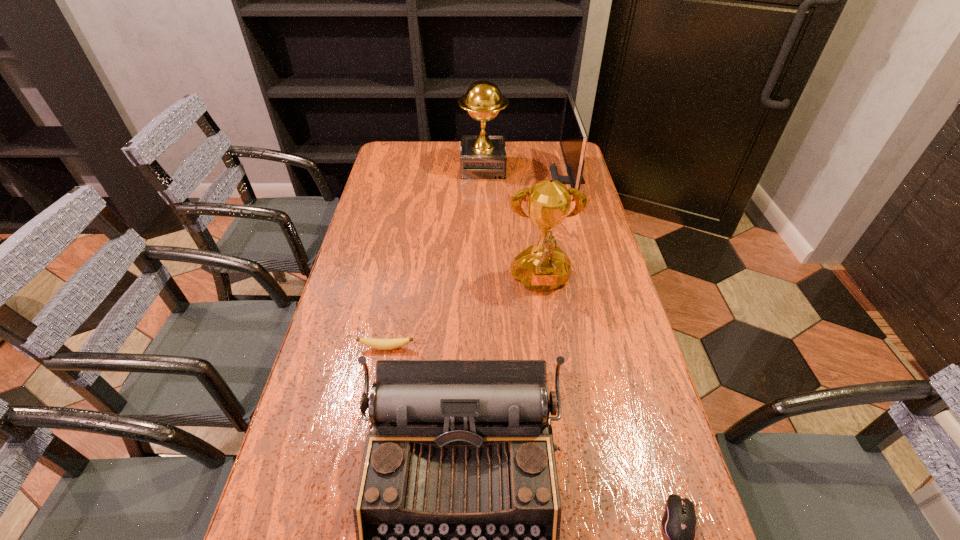
Identify the location of free region located on the screen side of the fourth shortest object. This screenshot has height=540, width=960. (537, 181).

At what (x,y) coordinates should I click in order to perform the action: click on blank space located 0.130m on the back of the fourth farthest object. Please return your answer as a coordinate pair (x, y). The height and width of the screenshot is (540, 960). Looking at the image, I should click on (395, 306).

This screenshot has width=960, height=540. Identify the location of award that is at the far edge. (482, 156).

Where is `monitor at the far edge`? monitor at the far edge is located at coordinates (573, 139).

At what (x,y) coordinates should I click in order to perform the action: click on object situated at the left edge. Please return your answer as a coordinate pair (x, y). This screenshot has height=540, width=960. Looking at the image, I should click on 381,344.

This screenshot has height=540, width=960. In order to click on award situated at the right edge in this screenshot , I will do `click(543, 267)`.

Where is `monitor present at the right edge`? The width and height of the screenshot is (960, 540). monitor present at the right edge is located at coordinates (573, 139).

Image resolution: width=960 pixels, height=540 pixels. Identify the location of object that is at the far right corner. (573, 139).

This screenshot has width=960, height=540. Find the location of `free space at the far edge`. free space at the far edge is located at coordinates (527, 165).

In the image, there is a desktop. What are the coordinates of `free space at the left edge` in the screenshot? It's located at (370, 206).